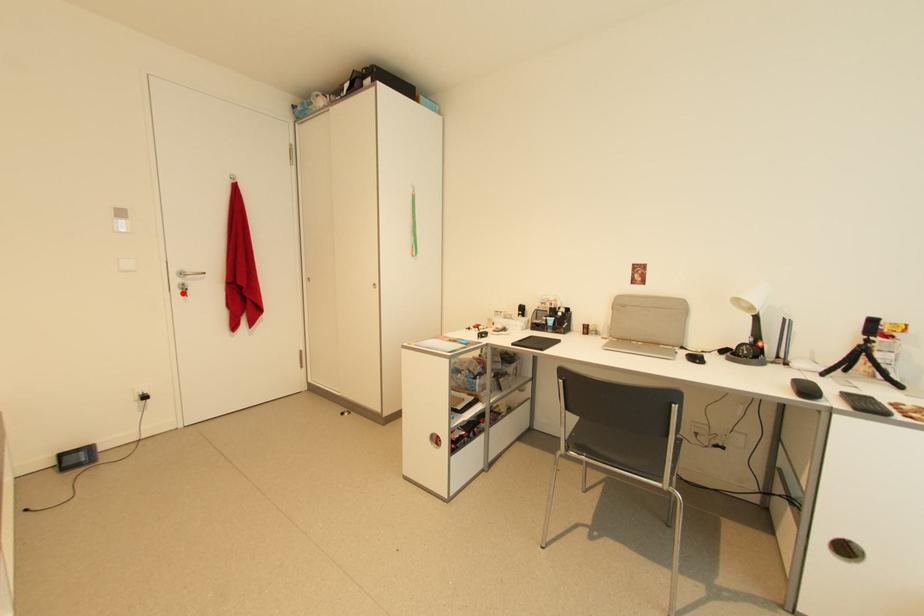
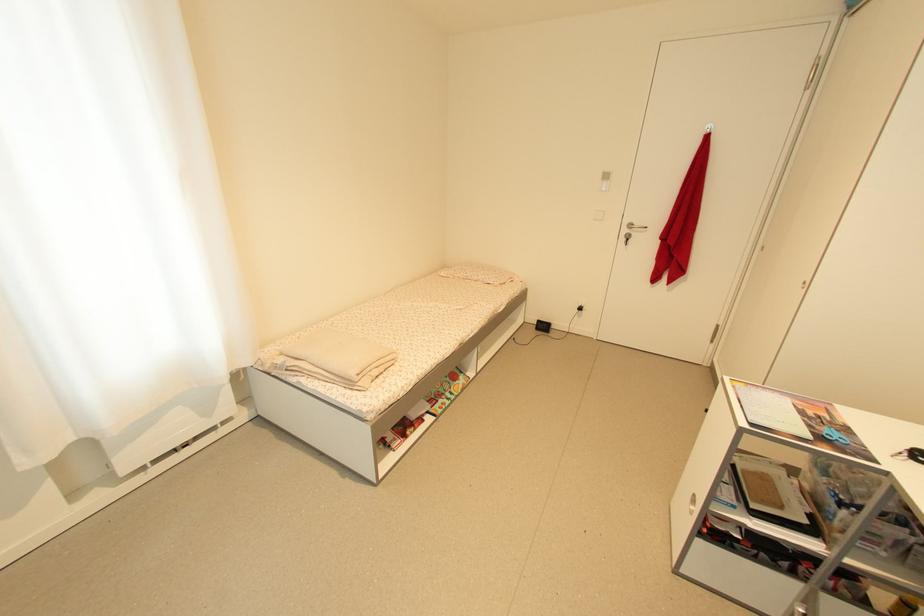
Where in the second image is the point corresponding to the highlighted location from the first image?

(627, 241)